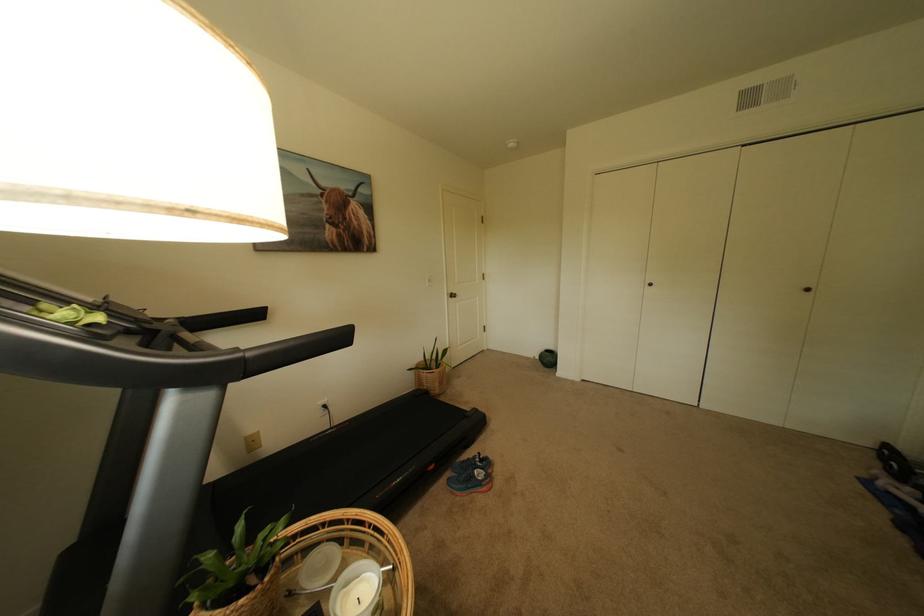
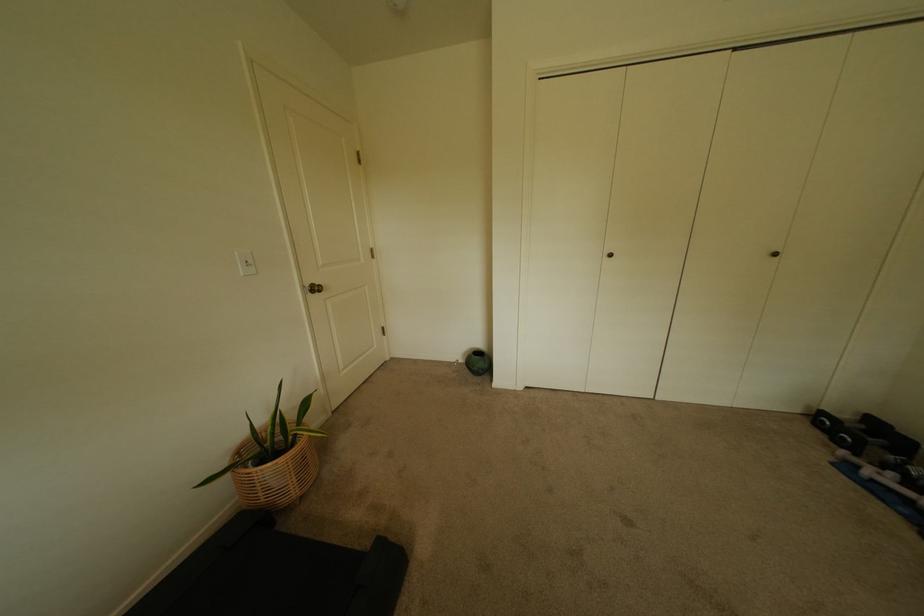
Where in the second image is the point corresponding to pixel 549 365 from the first image?

(476, 371)